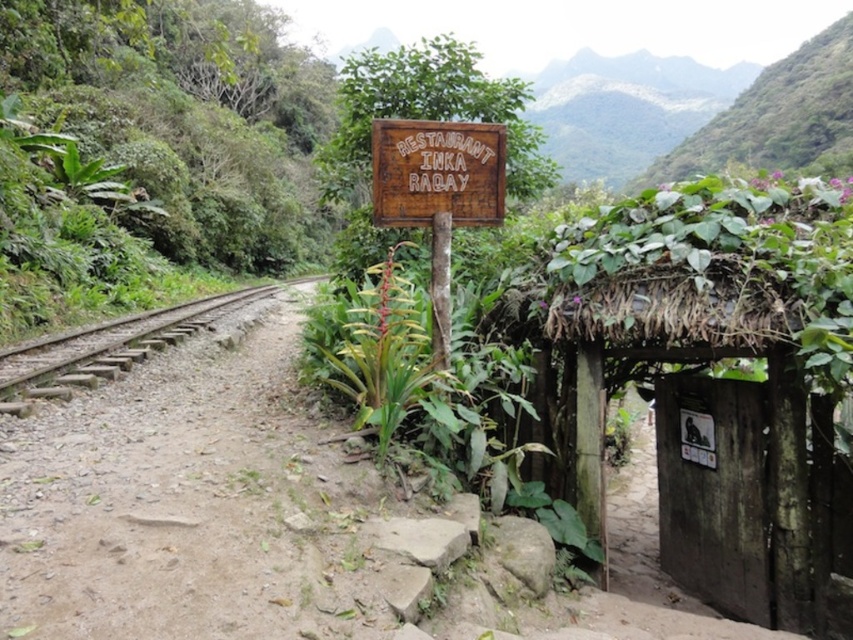
Question: Is the position of wooden thatched hut at right less distant than that of brown gravel dirt track at left?

Choices:
 (A) no
 (B) yes

Answer: (A)

Question: Which is farther from the wooden sign at center?

Choices:
 (A) wooden thatched hut at right
 (B) brown wooden train track at left
 (C) brown gravel dirt track at left

Answer: (B)

Question: Is wooden sign at center wider than brown wooden train track at left?

Choices:
 (A) yes
 (B) no

Answer: (B)

Question: Is wooden thatched hut at right above wooden sign at center?

Choices:
 (A) yes
 (B) no

Answer: (B)

Question: Among these objects, which one is nearest to the camera?

Choices:
 (A) brown gravel dirt track at left
 (B) wooden thatched hut at right
 (C) brown wooden train track at left
 (D) wooden sign at center

Answer: (A)

Question: Which of the following is the farthest from the observer?

Choices:
 (A) wooden sign at center
 (B) brown wooden train track at left
 (C) wooden thatched hut at right
 (D) brown gravel dirt track at left

Answer: (B)